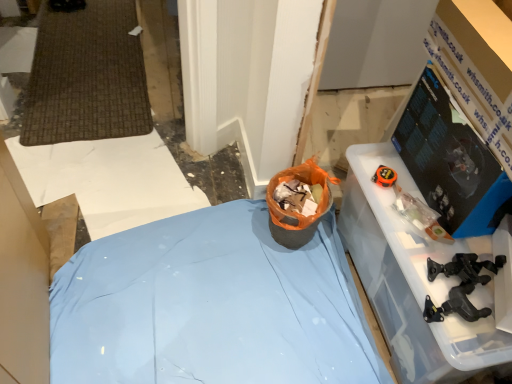
Question: Considering their positions, is black plastic tool at lower right located in front of or behind blue fabric bed at center, the 2th furniture positioned from the right?

Choices:
 (A) behind
 (B) front

Answer: (B)

Question: Is black plastic tool at lower right wider or thinner than blue fabric bed at center, the 2th furniture positioned from the right?

Choices:
 (A) thin
 (B) wide

Answer: (A)

Question: Which of these objects is positioned closest to the orange fabric bag at center?

Choices:
 (A) black plastic tool at lower right
 (B) black glossy monitor at upper right
 (C) blue fabric bed at center, the 2th furniture positioned from the right
 (D) transparent plastic container at right, which is counted as the 1th furniture, starting from the right

Answer: (D)

Question: Based on their relative distances, which object is nearer to the black glossy monitor at upper right?

Choices:
 (A) transparent plastic container at right, arranged as the 2th furniture when viewed from the left
 (B) black plastic tool at lower right
 (C) blue fabric bed at center, arranged as the first furniture when viewed from the left
 (D) orange fabric bag at center

Answer: (A)